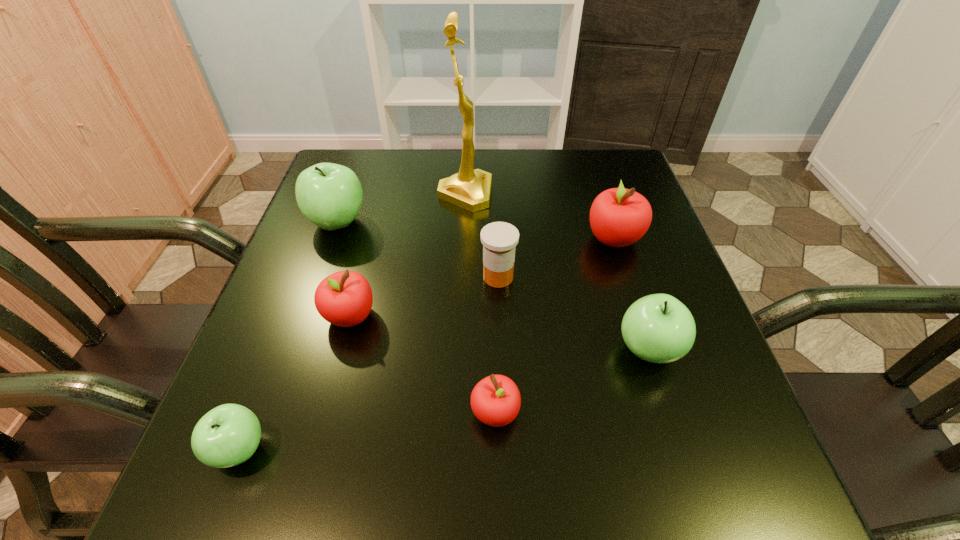
You are a GUI agent. You are given a task and a screenshot of the screen. Output one action in this format:
    pyautogui.click(x=<x>, y=<y>)
    Task: Click on the award
    Image resolution: width=960 pixels, height=540 pixels.
    Given the screenshot: What is the action you would take?
    pyautogui.click(x=470, y=189)

Find the location of `the tallest object`. the tallest object is located at coordinates (470, 189).

Identify the location of the rightmost red apple. Image resolution: width=960 pixels, height=540 pixels. (619, 217).

At what (x,y) coordinates should I click in order to perform the action: click on the biggest red apple. Please return your answer as a coordinate pair (x, y). The width and height of the screenshot is (960, 540). Looking at the image, I should click on (619, 217).

What are the coordinates of `the biggest green apple` in the screenshot? It's located at [329, 195].

What are the coordinates of `the second smallest green apple` in the screenshot? It's located at (658, 328).

The image size is (960, 540). What are the coordinates of `the second farthest green apple` in the screenshot? It's located at (658, 328).

Locate an element on the screen. This screenshot has width=960, height=540. the leftmost red apple is located at coordinates (344, 298).

Where is `the second nearest red apple`? This screenshot has width=960, height=540. the second nearest red apple is located at coordinates (344, 298).

Identify the location of orange medicine. (499, 239).